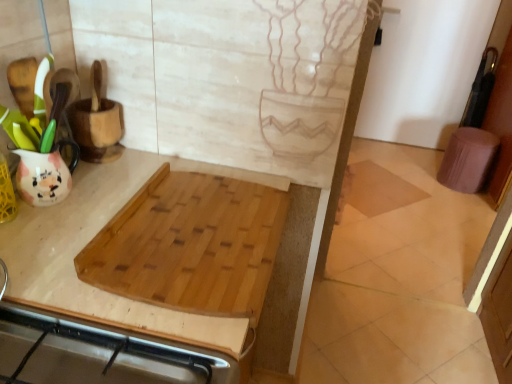
Locate an element on the screen. The height and width of the screenshot is (384, 512). free space in front of purple fabric step stool at right is located at coordinates coord(466,205).